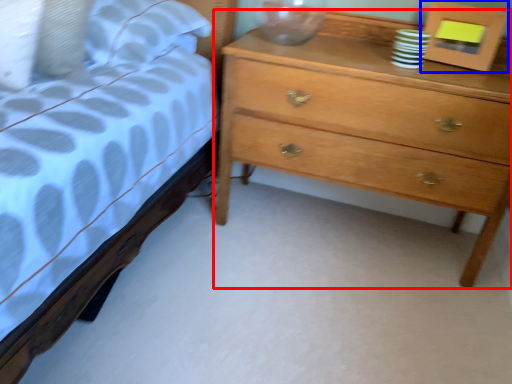
Question: Which of the following is the farthest to the observer, chest of drawers (highlighted by a red box) or picture frame (highlighted by a blue box)?

Choices:
 (A) chest of drawers
 (B) picture frame

Answer: (B)